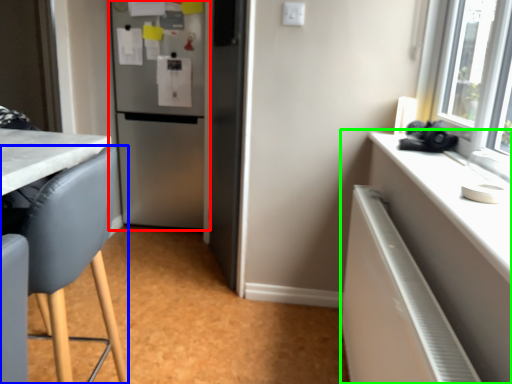
Question: Which object is the closest to the refrigerator (highlighted by a red box)? Choose among these: chair (highlighted by a blue box) or cabinetry (highlighted by a green box).

Choices:
 (A) chair
 (B) cabinetry

Answer: (A)